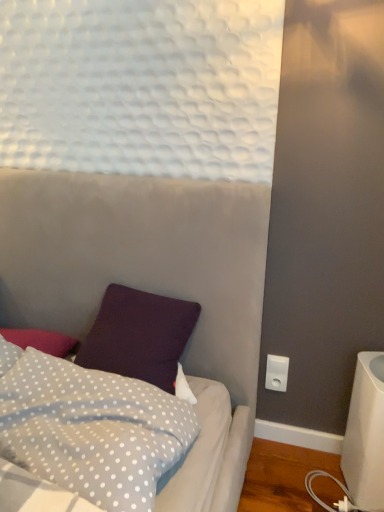
Question: From a real-world perspective, is white dotted fabric pillow at lower left above or below white plastic electric outlet at lower right?

Choices:
 (A) below
 (B) above

Answer: (B)

Question: Is white dotted fabric pillow at lower left inside the boundaries of white plastic electric outlet at lower right, or outside?

Choices:
 (A) outside
 (B) inside

Answer: (A)

Question: From the image's perspective, is white dotted fabric pillow at lower left above or below white plastic electric outlet at lower right?

Choices:
 (A) above
 (B) below

Answer: (B)

Question: Would you say white plastic electric outlet at lower right is inside or outside white dotted fabric pillow at lower left?

Choices:
 (A) outside
 (B) inside

Answer: (A)

Question: Does point (273, 374) appear closer or farther from the camera than point (84, 443)?

Choices:
 (A) closer
 (B) farther

Answer: (B)

Question: From a real-world perspective, relative to white dotted fabric pillow at lower left, is white plastic electric outlet at lower right vertically above or below?

Choices:
 (A) above
 (B) below

Answer: (B)

Question: Considering the positions of white plastic electric outlet at lower right and white dotted fabric pillow at lower left in the image, is white plastic electric outlet at lower right bigger or smaller than white dotted fabric pillow at lower left?

Choices:
 (A) big
 (B) small

Answer: (B)